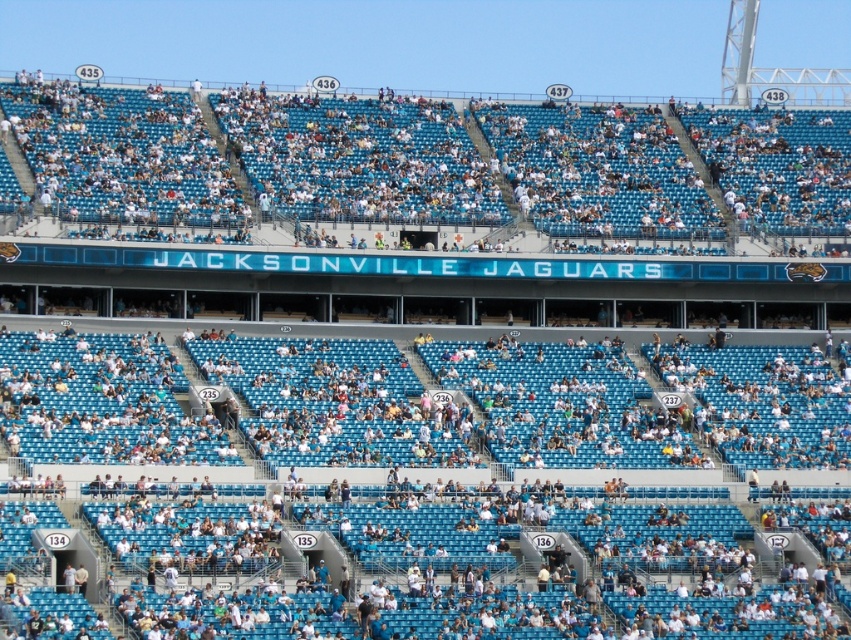
Question: Can you confirm if white plastic seats at center is thinner than light blue seats at center?

Choices:
 (A) yes
 (B) no

Answer: (A)

Question: Does white plastic seats at center have a lesser width compared to light blue seats at center?

Choices:
 (A) no
 (B) yes

Answer: (B)

Question: Which point is farther from the camera taking this photo?

Choices:
 (A) (21, 348)
 (B) (481, 208)

Answer: (B)

Question: Can you confirm if white plastic seats at center is positioned to the left of light blue seats at center?

Choices:
 (A) no
 (B) yes

Answer: (B)

Question: Which point is farther to the camera?

Choices:
 (A) light blue seats at center
 (B) white plastic seats at center

Answer: (A)

Question: Which point appears closest to the camera in this image?

Choices:
 (A) (269, 216)
 (B) (158, 376)

Answer: (B)